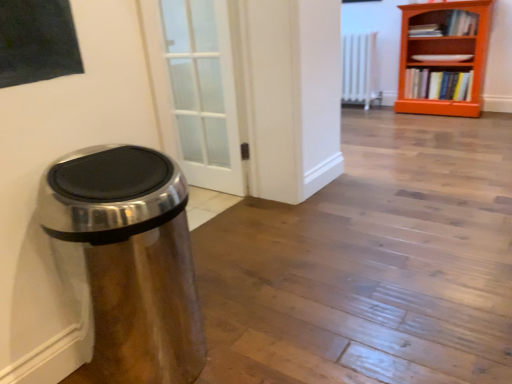
Locate an element on the screen. vacant space that is to the left of orange wooden bookcase at upper right is located at coordinates (386, 121).